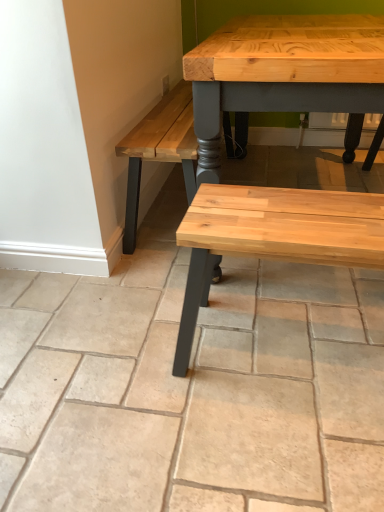
This screenshot has width=384, height=512. Find the location of `free area behind natural wood bench at center`. free area behind natural wood bench at center is located at coordinates (274, 285).